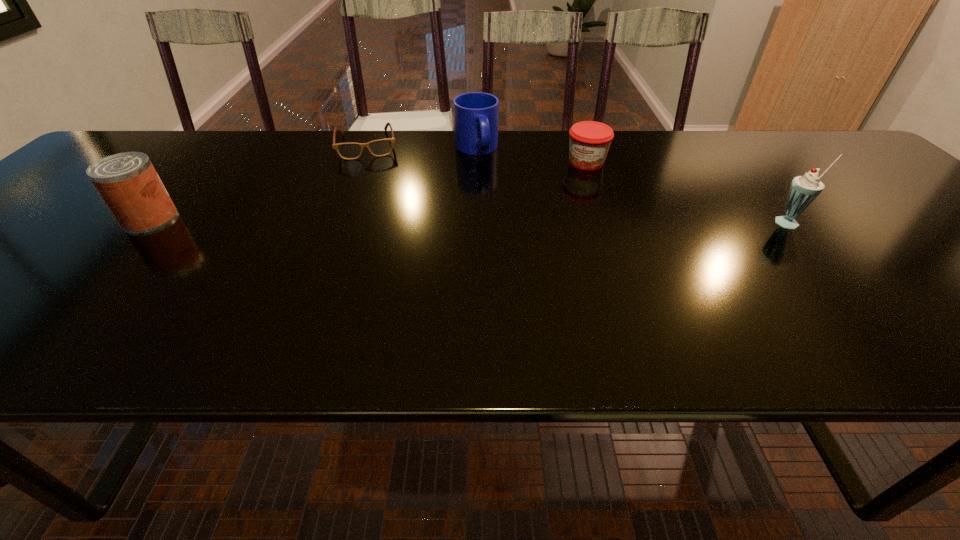
Find the location of a particular element. the leftmost object is located at coordinates (128, 183).

The height and width of the screenshot is (540, 960). In order to click on the rightmost object in this screenshot , I will do pyautogui.click(x=804, y=189).

Find the location of a particular element. mug is located at coordinates (476, 114).

This screenshot has width=960, height=540. What are the coordinates of `the second object from left to right` in the screenshot? It's located at (349, 151).

Where is `the shortest object`? Image resolution: width=960 pixels, height=540 pixels. the shortest object is located at coordinates point(349,151).

Locate an element on the screen. The height and width of the screenshot is (540, 960). the second object from right to left is located at coordinates (589, 140).

I want to click on the second shortest object, so click(x=589, y=140).

Image resolution: width=960 pixels, height=540 pixels. In order to click on vacant space located on the right of the leftmost object in this screenshot , I will do `click(202, 219)`.

Identify the location of free spot located on the straw side of the rightmost object. Image resolution: width=960 pixels, height=540 pixels. (836, 274).

You are a GUI agent. You are given a task and a screenshot of the screen. Output one action in this format:
    pyautogui.click(x=<x>, y=<y>)
    Task: Click on the vacant space situated 0.090m on the side with the handle of the mug
    The width and height of the screenshot is (960, 540).
    Given the screenshot: What is the action you would take?
    [490, 181]